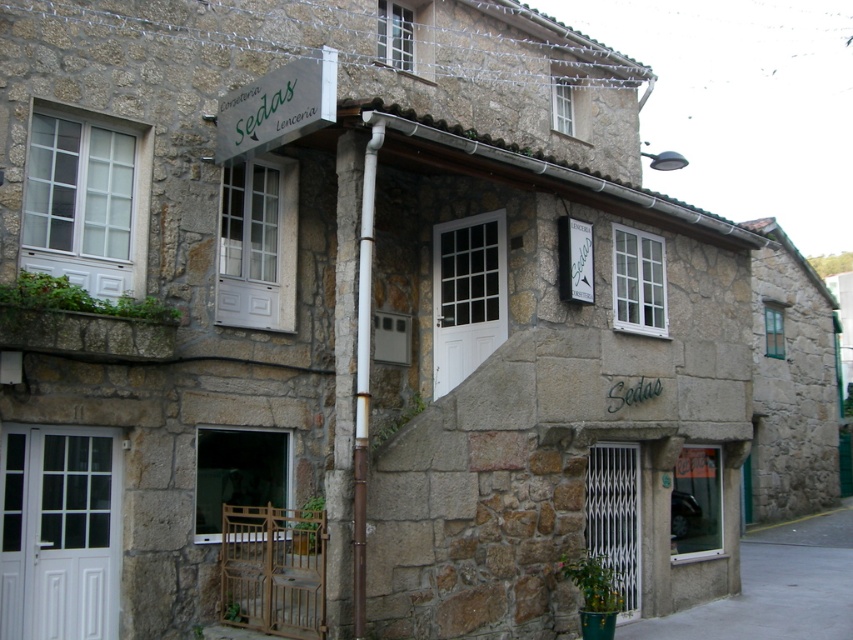
You are standing in front of the stone building and want to determine the relative positions of two points marked on the facade. Which point is closer to you, point 1 at coordinates (x=340, y=518) or point 2 at coordinates (x=352, y=444)?

Point 1 at coordinates (x=340, y=518) is closer to the viewer than point 2 at coordinates (x=352, y=444).

You are standing in front of the quaint stone building and want to locate the brown stone pillar at center. Can you tell me the coordinates where it is located?

The brown stone pillar at center is located at coordinates point (351, 376).